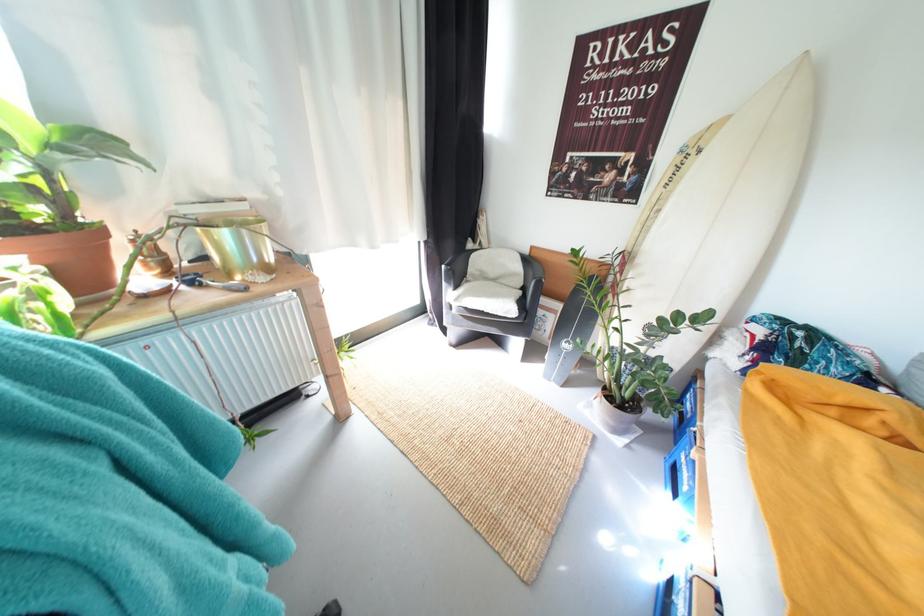
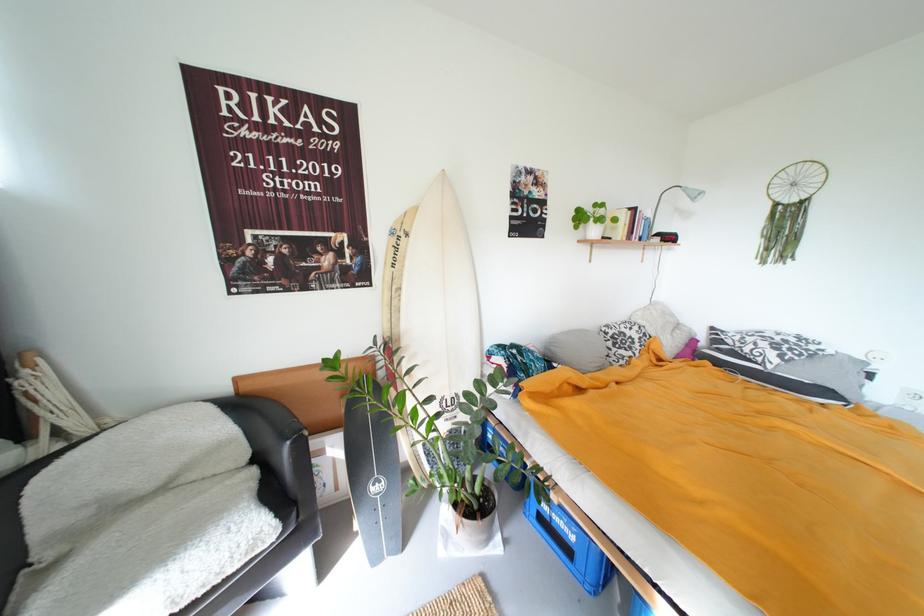
Where in the second image is the point corresponding to (x=525, y=313) from the first image?

(284, 524)